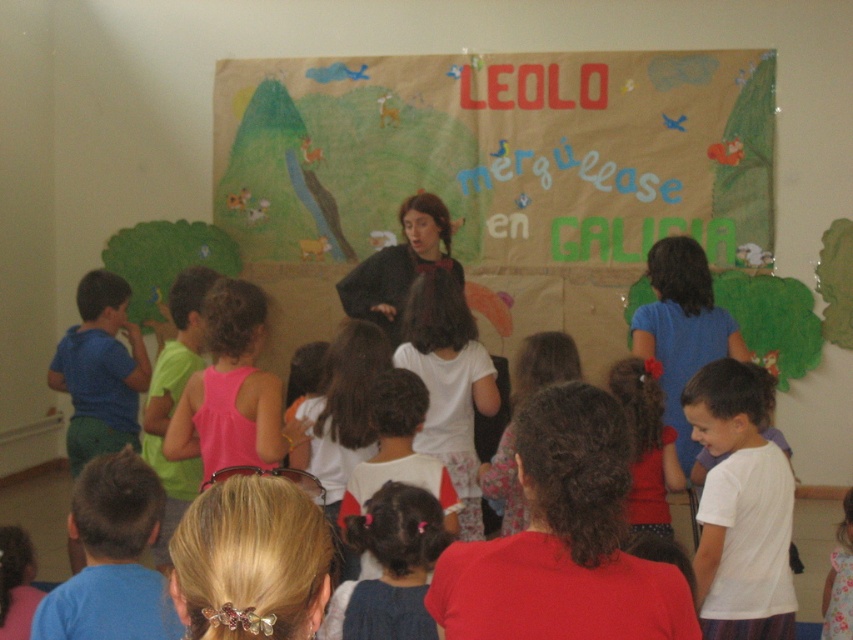
Question: Is brown paper banner at center above matte black sweater at center?

Choices:
 (A) yes
 (B) no

Answer: (A)

Question: Which of the following is the closest to the observer?

Choices:
 (A) (x=526, y=230)
 (B) (x=418, y=230)

Answer: (B)

Question: Is brown paper banner at center to the right of matte black sweater at center from the viewer's perspective?

Choices:
 (A) no
 (B) yes

Answer: (B)

Question: Which of the following is the farthest from the observer?

Choices:
 (A) brown paper banner at center
 (B) matte black sweater at center

Answer: (A)

Question: Does brown paper banner at center come in front of matte black sweater at center?

Choices:
 (A) no
 (B) yes

Answer: (A)

Question: Among these objects, which one is farthest from the camera?

Choices:
 (A) matte black sweater at center
 (B) brown paper banner at center

Answer: (B)